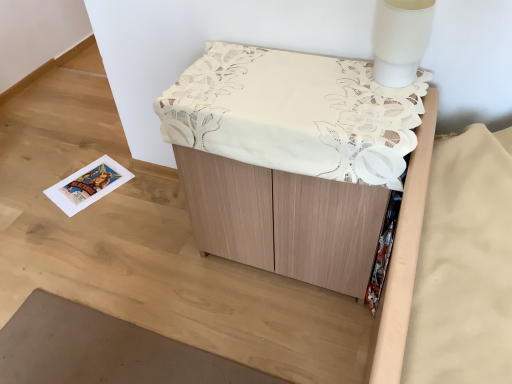
Identify the location of free spot above wooden cabinet at center (from a real-world perspective). Image resolution: width=512 pixels, height=384 pixels. point(290,84).